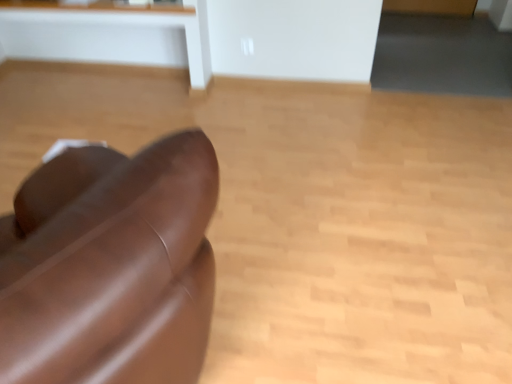
Image resolution: width=512 pixels, height=384 pixels. What do you see at coordinates (110, 34) in the screenshot? I see `white glossy table at upper center` at bounding box center [110, 34].

The image size is (512, 384). I want to click on white glossy table at upper center, so click(110, 34).

What is the approximate height of white glossy table at upper center?

white glossy table at upper center is 24.72 inches tall.

At what (x,y) coordinates should I click in order to perform the action: click on white glossy table at upper center. Please return your answer as a coordinate pair (x, y). This screenshot has width=512, height=384. Looking at the image, I should click on (110, 34).